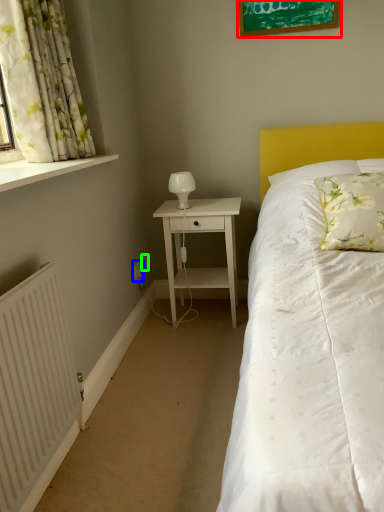
Question: Which object is the closest to the picture frame (highlighted by a red box)? Choose among these: electric outlet (highlighted by a blue box) or electric outlet (highlighted by a green box).

Choices:
 (A) electric outlet
 (B) electric outlet

Answer: (B)